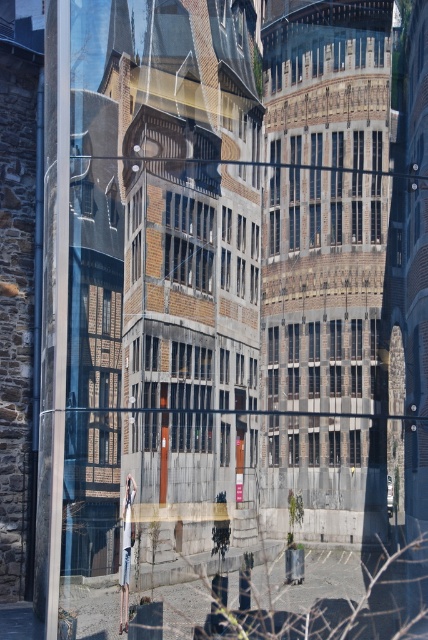
Question: Estimate the real-world distances between objects in this image. Which object is farther from the dark gray stone window at center?

Choices:
 (A) brown brick window at center
 (B) metallic statue at center

Answer: (B)

Question: Is dark gray stone window at center wider than metallic statue at center?

Choices:
 (A) yes
 (B) no

Answer: (A)

Question: Is dark gray stone window at center to the left of metallic statue at center from the viewer's perspective?

Choices:
 (A) yes
 (B) no

Answer: (B)

Question: Can you confirm if dark gray stone window at center is wider than metallic statue at center?

Choices:
 (A) no
 (B) yes

Answer: (B)

Question: Which is nearer to the dark gray stone window at center?

Choices:
 (A) metallic statue at center
 (B) brown brick window at center

Answer: (B)

Question: Which object is closer to the camera taking this photo?

Choices:
 (A) brown brick window at center
 (B) dark gray stone window at center

Answer: (B)